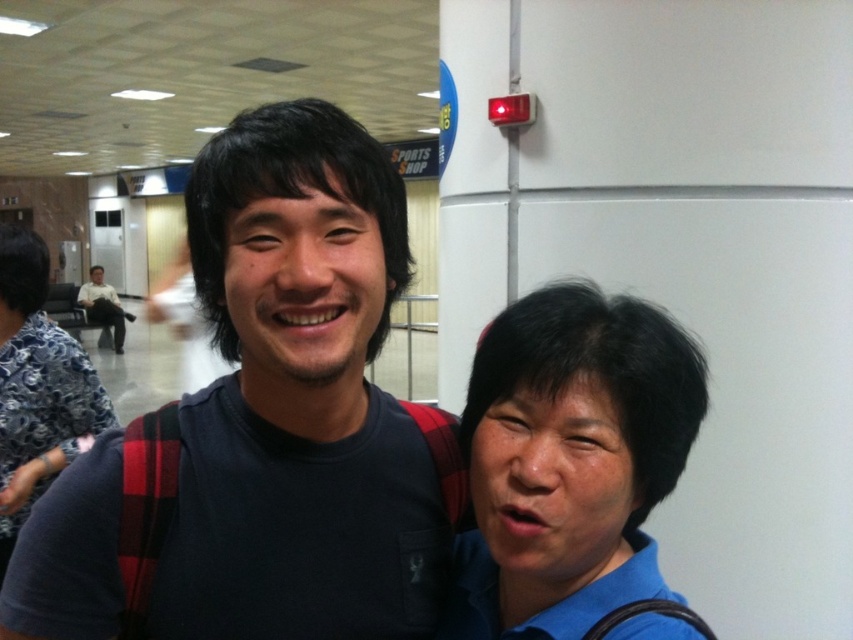
Question: Which of the following is the farthest from the observer?

Choices:
 (A) (120, 316)
 (B) (242, 184)
 (C) (48, 378)

Answer: (A)

Question: Considering the real-world distances, which object is farthest from the matte black shirt at left?

Choices:
 (A) floral-patterned shirt at left
 (B) dark blue t-shirt at center

Answer: (B)

Question: Does dark blue t-shirt at center lie behind matte black shirt at left?

Choices:
 (A) yes
 (B) no

Answer: (B)

Question: Observing the image, what is the correct spatial positioning of floral-patterned shirt at left in reference to matte black shirt at left?

Choices:
 (A) left
 (B) right

Answer: (B)

Question: Is dark blue t-shirt at center behind floral-patterned shirt at left?

Choices:
 (A) no
 (B) yes

Answer: (A)

Question: Which of the following is the closest to the observer?

Choices:
 (A) (631, 356)
 (B) (120, 326)

Answer: (A)